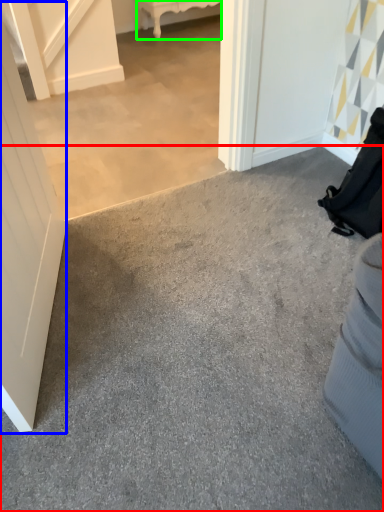
Question: Considering the real-world distances, which object is closest to concrete (highlighted by a red box)? door (highlighted by a blue box) or furniture (highlighted by a green box).

Choices:
 (A) door
 (B) furniture

Answer: (A)